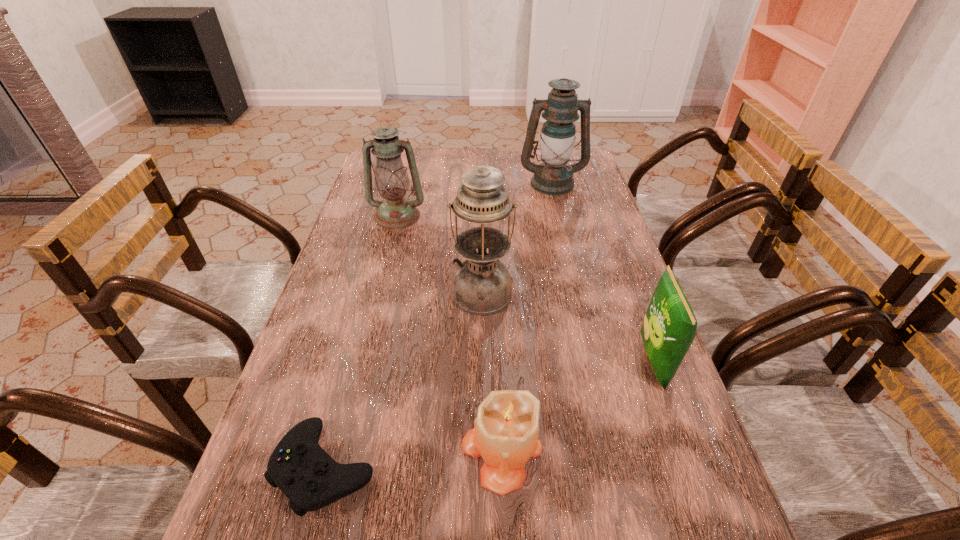
Find the location of a particular element. This screenshot has width=960, height=540. free space located on the front of the farthest oil lamp is located at coordinates (568, 254).

The width and height of the screenshot is (960, 540). Identify the location of free space located 0.290m on the front of the second oil lamp from right to left. click(483, 426).

I want to click on vacant space located 0.260m on the right of the second nearest oil lamp, so click(508, 216).

Where is `vacant region located 0.070m on the front-facing side of the crisp (potato chip)`? vacant region located 0.070m on the front-facing side of the crisp (potato chip) is located at coordinates (609, 362).

Locate an element on the screen. vacant region located 0.170m on the front-facing side of the crisp (potato chip) is located at coordinates (563, 362).

You are a GUI agent. You are given a task and a screenshot of the screen. Output one action in this format:
    pyautogui.click(x=<x>, y=<y>)
    Task: Click on the free space located 0.380m on the front-facing side of the crisp (potato chip)
    The width and height of the screenshot is (960, 540).
    Given the screenshot: What is the action you would take?
    pyautogui.click(x=467, y=362)

Image resolution: width=960 pixels, height=540 pixels. I want to click on free region located on the left of the candle, so (408, 449).

Where is `blank space located on the right of the shortest object`? The height and width of the screenshot is (540, 960). blank space located on the right of the shortest object is located at coordinates (420, 467).

Locate an element on the screen. This screenshot has height=540, width=960. object situated at the far edge is located at coordinates (552, 177).

In order to click on oil lamp that is at the left edge in this screenshot , I will do `click(395, 211)`.